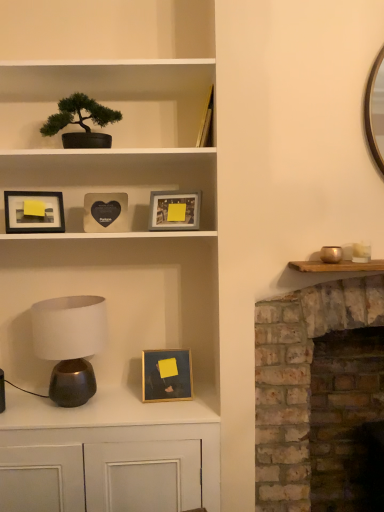
Question: Is matte gray picture frame at upper center, acting as the 3th picture frame starting from the bottom, aimed at brick fireplace at right?

Choices:
 (A) yes
 (B) no

Answer: (B)

Question: Does matte gray picture frame at upper center, which is the fourth picture frame in left-to-right order, appear on the left side of brick fireplace at right?

Choices:
 (A) no
 (B) yes

Answer: (B)

Question: Considering the relative sizes of matte gray picture frame at upper center, the first picture frame in the right-to-left sequence, and brick fireplace at right in the image provided, is matte gray picture frame at upper center, the first picture frame in the right-to-left sequence, smaller than brick fireplace at right?

Choices:
 (A) yes
 (B) no

Answer: (A)

Question: From the image's perspective, does matte gray picture frame at upper center, the first picture frame in the right-to-left sequence, appear higher than brick fireplace at right?

Choices:
 (A) no
 (B) yes

Answer: (B)

Question: From a real-world perspective, is matte gray picture frame at upper center, which is the fourth picture frame in left-to-right order, physically above brick fireplace at right?

Choices:
 (A) yes
 (B) no

Answer: (A)

Question: Looking at the image, does brick fireplace at right seem bigger or smaller compared to gold metallic bowl at right?

Choices:
 (A) big
 (B) small

Answer: (A)

Question: Based on their positions, is brick fireplace at right located to the left or right of gold metallic bowl at right?

Choices:
 (A) left
 (B) right

Answer: (B)

Question: From their relative heights in the image, would you say brick fireplace at right is taller or shorter than gold metallic bowl at right?

Choices:
 (A) tall
 (B) short

Answer: (A)

Question: Is point (274, 336) closer or farther from the camera than point (329, 261)?

Choices:
 (A) farther
 (B) closer

Answer: (A)

Question: Considering their positions, is matte black bonsai tree at upper left located in front of or behind gold/glossy picture frame at center, the 2th picture frame positioned from the right?

Choices:
 (A) behind
 (B) front

Answer: (B)

Question: Considering the positions of matte black bonsai tree at upper left and gold/glossy picture frame at center, which appears as the third picture frame when viewed from the left, in the image, is matte black bonsai tree at upper left bigger or smaller than gold/glossy picture frame at center, which appears as the third picture frame when viewed from the left,?

Choices:
 (A) big
 (B) small

Answer: (A)

Question: Is point (178, 70) positioned closer to the camera than point (190, 355)?

Choices:
 (A) farther
 (B) closer

Answer: (B)

Question: From a real-world perspective, is matte black bonsai tree at upper left above or below gold/glossy picture frame at center, the 4th picture frame in the top-to-bottom sequence?

Choices:
 (A) below
 (B) above

Answer: (B)

Question: Considering their positions, is green matte bonsai tree at upper left located in front of or behind matte black bonsai tree at upper left?

Choices:
 (A) behind
 (B) front

Answer: (A)

Question: Considering the positions of green matte bonsai tree at upper left and matte black bonsai tree at upper left in the image, is green matte bonsai tree at upper left wider or thinner than matte black bonsai tree at upper left?

Choices:
 (A) wide
 (B) thin

Answer: (B)